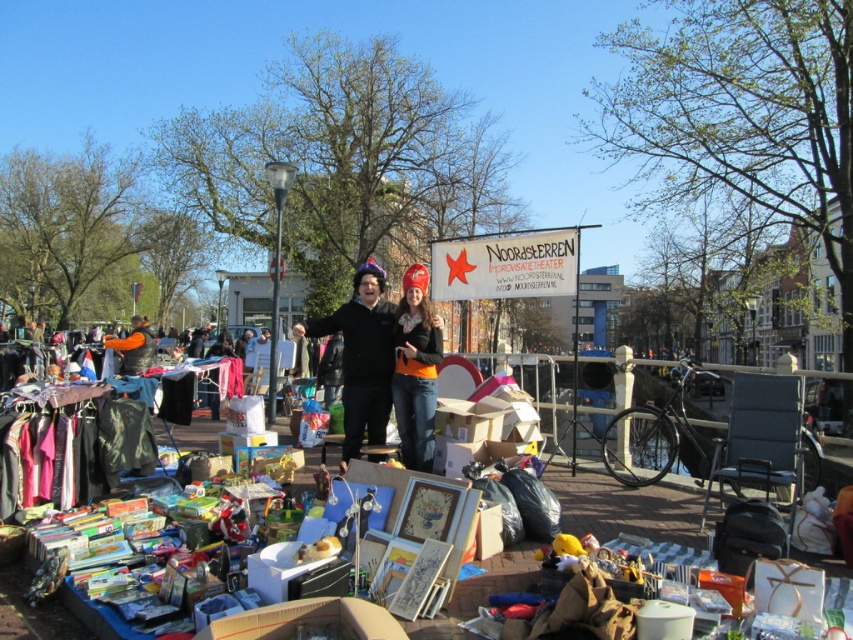
You are a customer at the flea market and want to buy an orange item. You see the orange fabric pants at center and the orange fleece vest at center. Which one is smaller?

The orange fabric pants at center is smaller than the orange fleece vest at center.

You are a customer at the flea market and want to pick up the orange fabric jacket at center. Can you reach it without moving the wooden table at center?

The wooden table at center is taller than orange fabric jacket at center, so yes, you can reach the orange fabric jacket at center without moving the wooden table at center since it is shorter than the table.